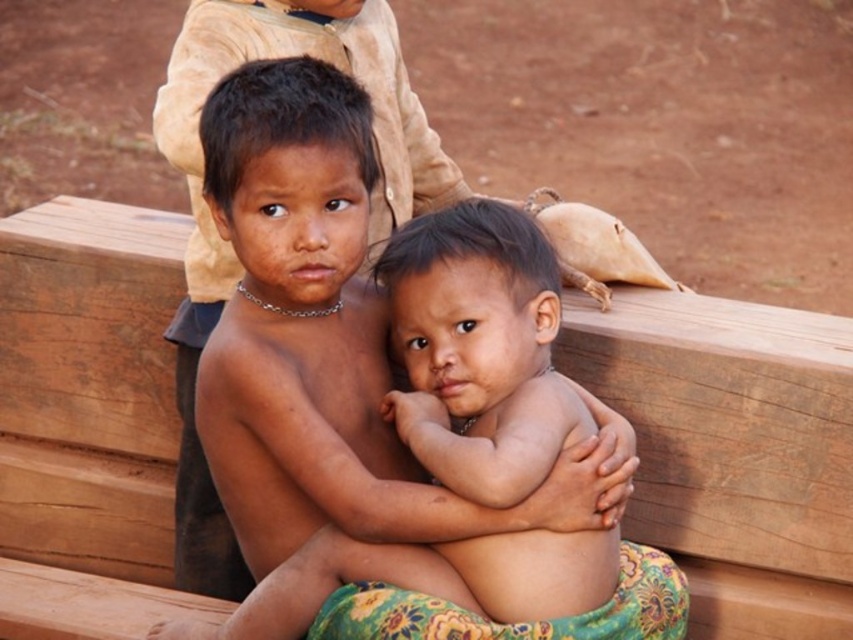
Question: Where is brown wooden bench at center located in relation to smooth skin child at center in the image?

Choices:
 (A) above
 (B) below

Answer: (B)

Question: Does brown wooden bench at center have a lesser width compared to smooth skin child at center?

Choices:
 (A) yes
 (B) no

Answer: (A)

Question: Does brown wooden bench at center appear on the left side of smooth skin child at center?

Choices:
 (A) yes
 (B) no

Answer: (A)

Question: Which point is closer to the camera taking this photo?

Choices:
 (A) (184, 564)
 (B) (12, 294)

Answer: (A)